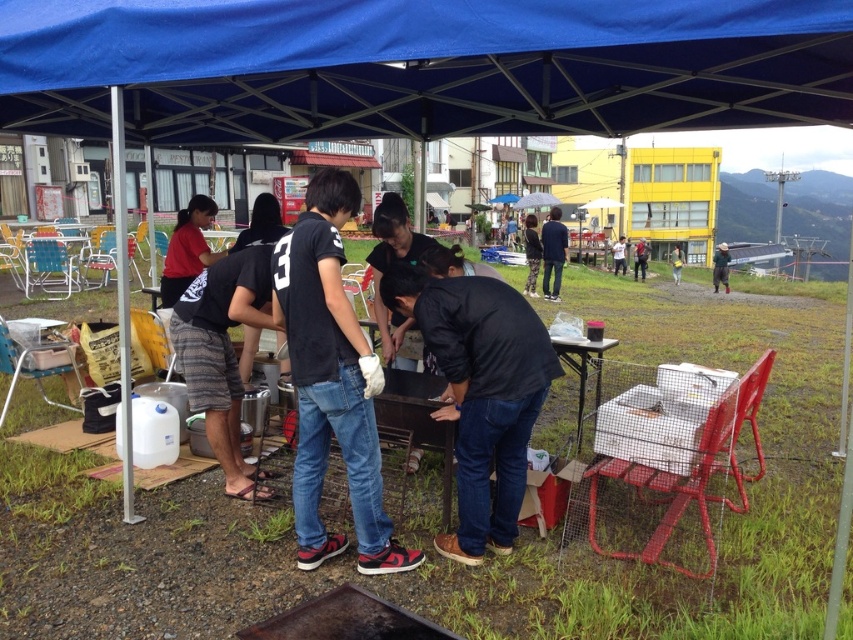
Does point (13, 96) come closer to viewer compared to point (57, 250)?

Yes.

The width and height of the screenshot is (853, 640). Find the location of `blue fabric canopy at upper center`. blue fabric canopy at upper center is located at coordinates coord(421,67).

Does black cotton shirt at center have a lesser width compared to metallic silver table at center?

No.

Is the position of black cotton shirt at center less distant than that of metallic silver table at center?

Yes, it is in front of metallic silver table at center.

Where is `black cotton shirt at center`? black cotton shirt at center is located at coordinates (331, 380).

Looking at this image, measure the distance between plastic folding table at left and metallic silver table at center.

plastic folding table at left and metallic silver table at center are 31.73 feet apart.

Is plastic folding table at left positioned before metallic silver table at center?

No, it is behind metallic silver table at center.

Locate an element on the screen. The width and height of the screenshot is (853, 640). plastic folding table at left is located at coordinates (51, 268).